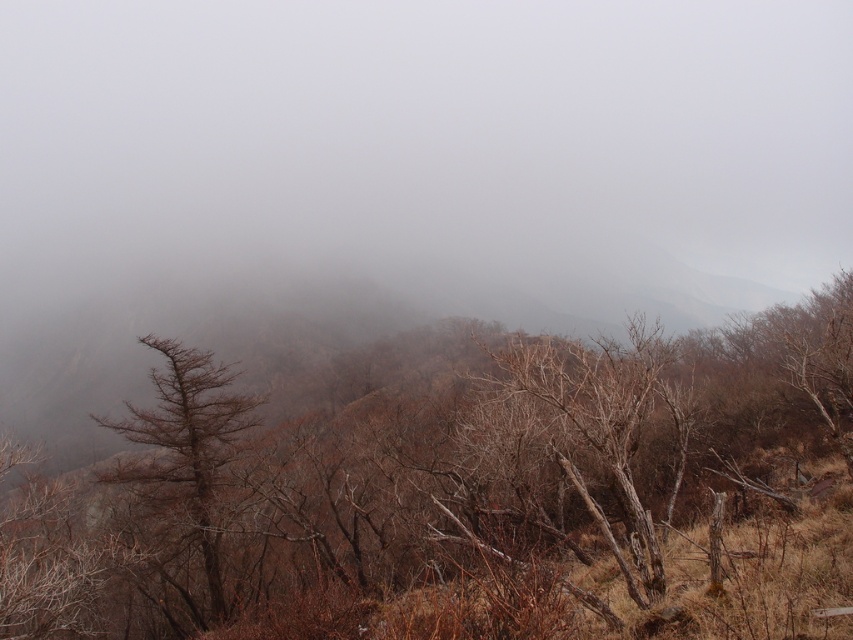
Question: Observing the image, what is the correct spatial positioning of brown matte tree at center in reference to brown matte tree at left?

Choices:
 (A) above
 (B) below

Answer: (A)

Question: Among these points, which one is farthest from the camera?

Choices:
 (A) (628, 372)
 (B) (155, 436)

Answer: (B)

Question: Does brown matte tree at center appear under brown matte tree at left?

Choices:
 (A) no
 (B) yes

Answer: (A)

Question: Is the position of brown matte tree at center more distant than that of brown matte tree at left?

Choices:
 (A) yes
 (B) no

Answer: (B)